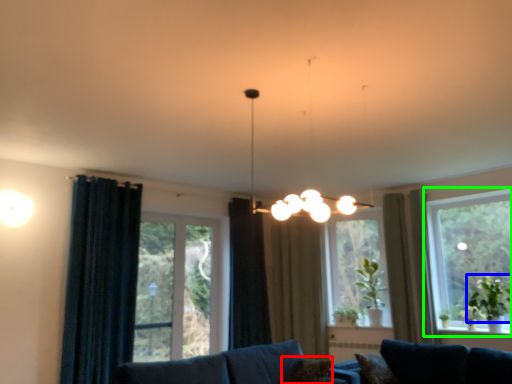
Question: Which is farther away from pillow (highlighted by a red box)? plant (highlighted by a blue box) or window (highlighted by a green box)?

Choices:
 (A) plant
 (B) window

Answer: (B)